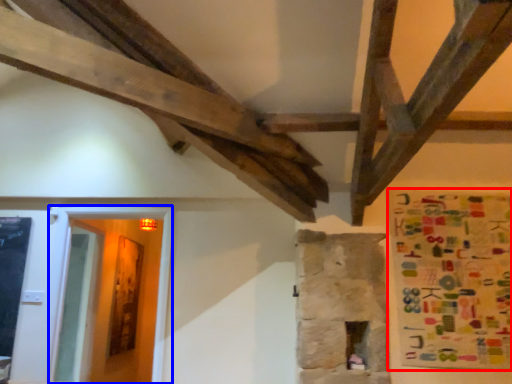
Question: Which object is further to the camera taking this photo, poster (highlighted by a red box) or glass door (highlighted by a blue box)?

Choices:
 (A) poster
 (B) glass door

Answer: (B)